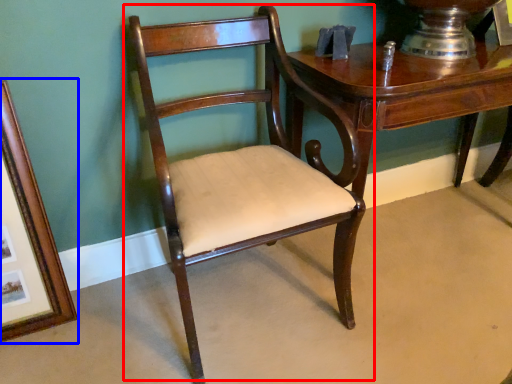
Question: Which of the following is the farthest to the observer, chair (highlighted by a red box) or picture frame (highlighted by a blue box)?

Choices:
 (A) chair
 (B) picture frame

Answer: (B)